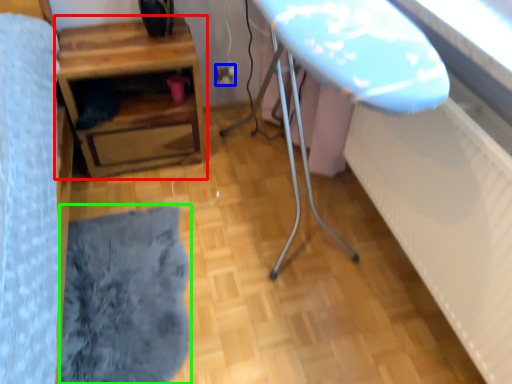
Question: Estimate the real-world distances between objects in this image. Which object is closer to table (highlighted by a red box), electric outlet (highlighted by a blue box) or flat (highlighted by a green box)?

Choices:
 (A) electric outlet
 (B) flat

Answer: (A)